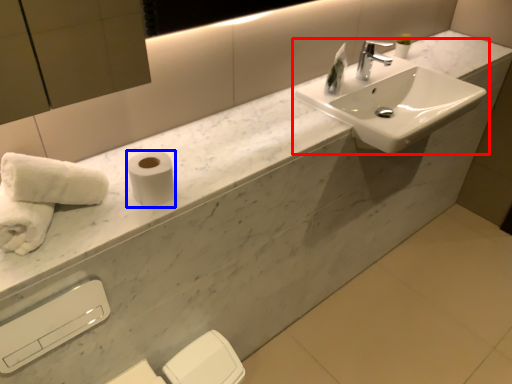
Question: Which point is further to the camera, sink (highlighted by a red box) or toilet paper (highlighted by a blue box)?

Choices:
 (A) sink
 (B) toilet paper

Answer: (A)